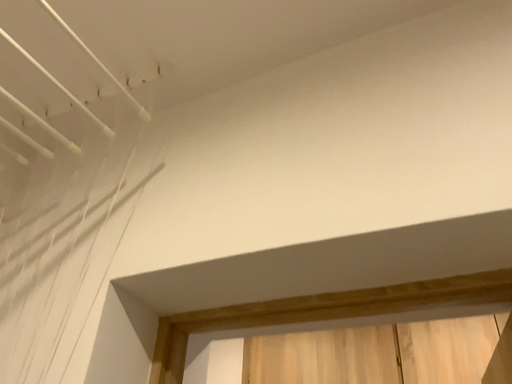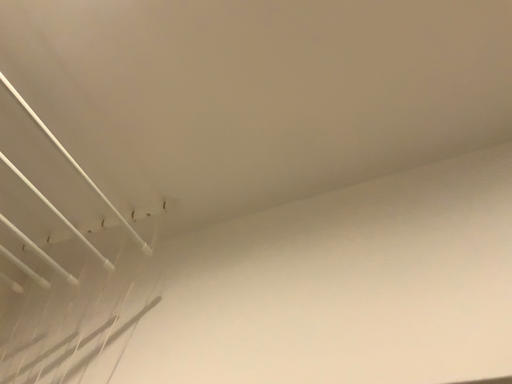
Question: How did the camera likely rotate when shooting the video?

Choices:
 (A) rotated downward
 (B) rotated upward

Answer: (B)